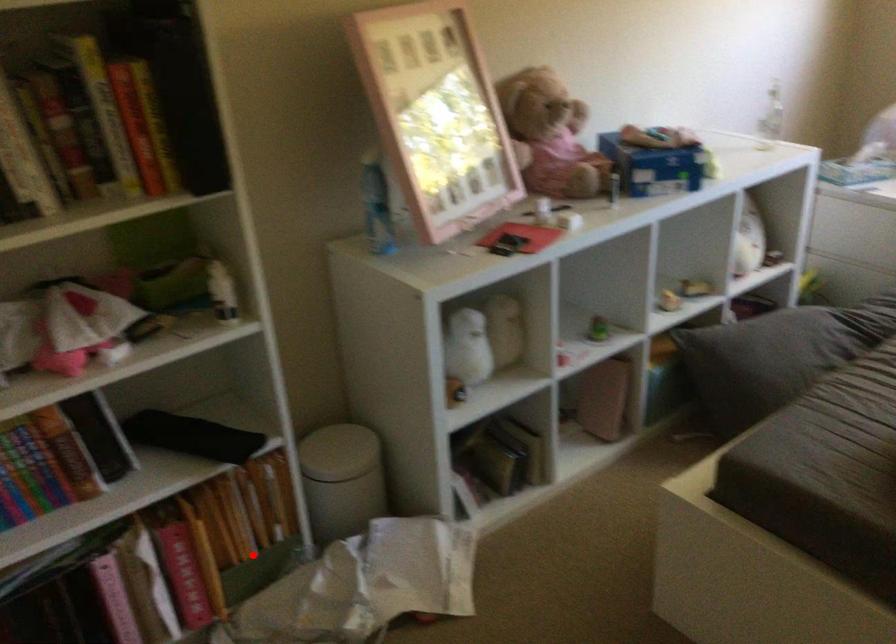
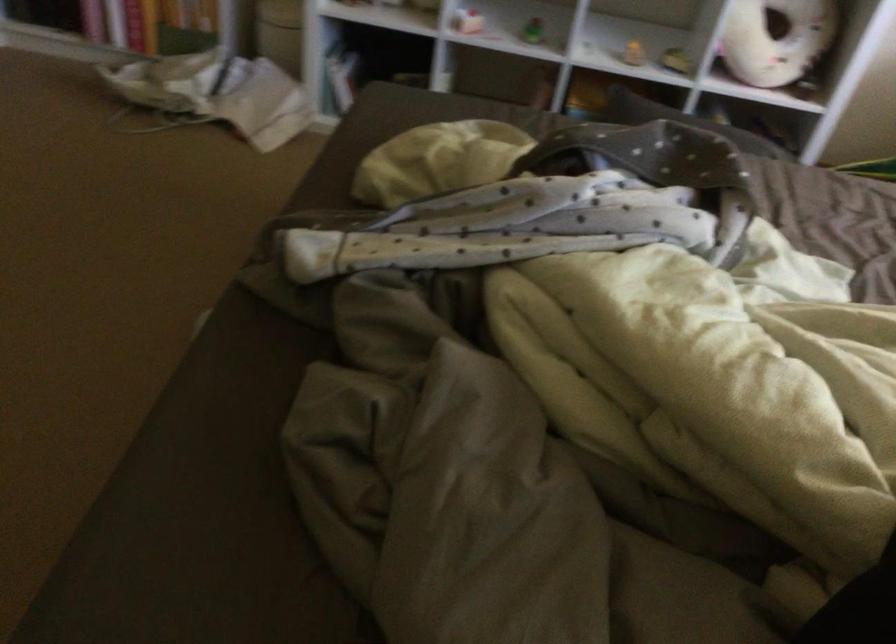
In the second image, find the point that corresponds to the highlighted location in the first image.

(177, 13)